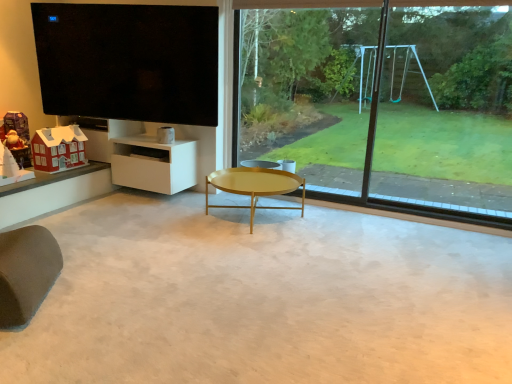
Image resolution: width=512 pixels, height=384 pixels. What are the coordinates of `free spot in front of gold metallic coffee table at center` in the screenshot? It's located at (252, 249).